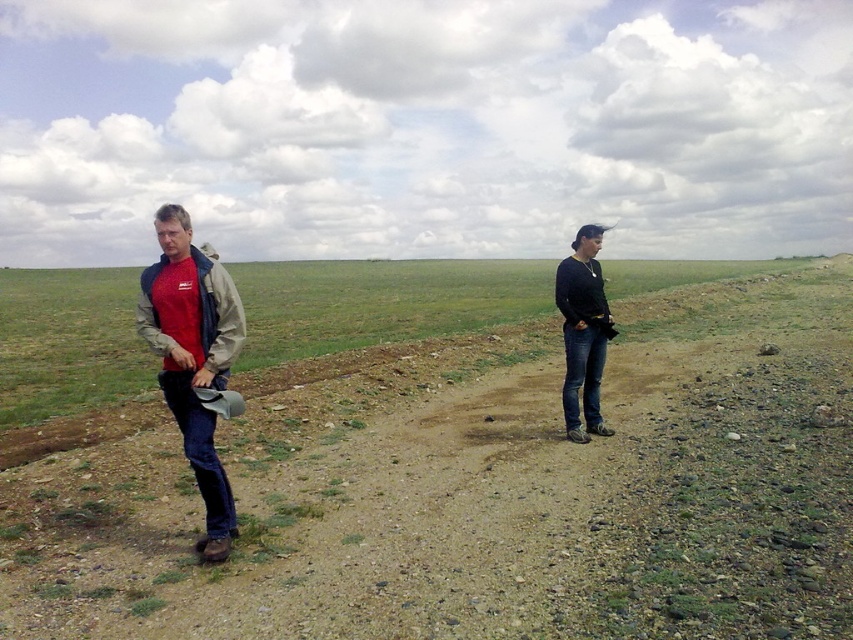
You are standing at the point marked by the coordinates point (476, 484) in the image. What type of terrain are you currently standing on?

The point (476, 484) corresponds to dirt at center, so you are standing on dirt terrain.

You are planning to take a photo of the matte red shirt at left and the black matte jacket at right in the open field. Considering their positions and sizes, which one might appear larger in the photo?

The matte red shirt at left might appear larger in the photo since it is wider than the black matte jacket at right according to the description.

You are standing in the open field described in the scene. You need to place a small flag exactly at the center of the dirt at center. According to the coordinates provided, what are the exact coordinates where you should place the flag?

The exact coordinates for placing the flag on the dirt at center are point [476,484].